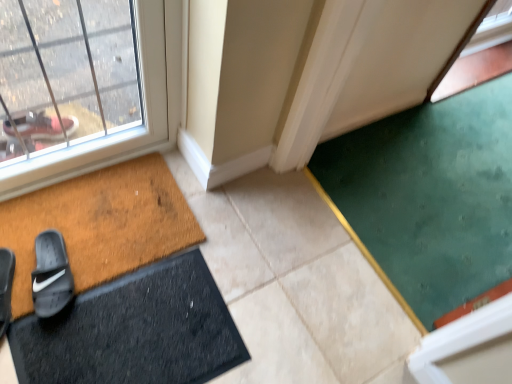
Question: Visually, is black suede slide at lower left, the 1th footwear viewed from the left, positioned to the left or to the right of black rubber slide at lower left, which is the second footwear in left-to-right order?

Choices:
 (A) left
 (B) right

Answer: (A)

Question: Looking at the image, does black suede slide at lower left, acting as the second footwear starting from the right, seem bigger or smaller compared to black rubber slide at lower left, positioned as the first footwear in right-to-left order?

Choices:
 (A) small
 (B) big

Answer: (A)

Question: Considering the real-world distances, which object is closest to the black suede slide at lower left, acting as the second footwear starting from the right?

Choices:
 (A) green carpet at lower right
 (B) brown textured doormat at lower left, which appears as the 1th bath mat when viewed from the top
 (C) black rubber bath mat at lower left, positioned as the first bath mat in bottom-to-top order
 (D) black rubber slide at lower left, positioned as the first footwear in right-to-left order

Answer: (D)

Question: Which is farther from the green carpet at lower right?

Choices:
 (A) brown textured doormat at lower left, which appears as the 1th bath mat when viewed from the top
 (B) black rubber bath mat at lower left, positioned as the first bath mat in bottom-to-top order
 (C) black suede slide at lower left, acting as the second footwear starting from the right
 (D) black rubber slide at lower left, which is the second footwear in left-to-right order

Answer: (C)